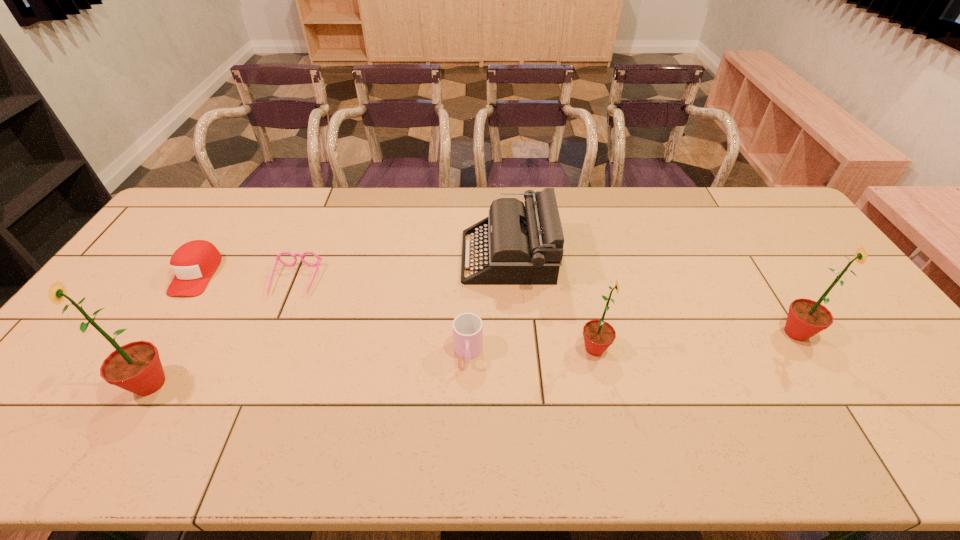
The width and height of the screenshot is (960, 540). Find the location of `vacant space situated 0.200m on the face of the nearest sunflower`. vacant space situated 0.200m on the face of the nearest sunflower is located at coordinates (45, 384).

At what (x,y) coordinates should I click in order to perform the action: click on vacant space located 0.050m on the face of the nearest sunflower. Please return your answer as a coordinate pair (x, y). This screenshot has height=540, width=960. Looking at the image, I should click on (107, 384).

You are a GUI agent. You are given a task and a screenshot of the screen. Output one action in this format:
    pyautogui.click(x=<x>, y=<y>)
    Task: Click on the vacant space located 0.160m on the face of the nearest sunflower
    This screenshot has height=540, width=960.
    Given the screenshot: What is the action you would take?
    pyautogui.click(x=61, y=384)

Locate an element on the screen. free location located on the face of the sixth object from left to right is located at coordinates (649, 349).

Where is `free space located on the face of the second tallest sunflower`? This screenshot has width=960, height=540. free space located on the face of the second tallest sunflower is located at coordinates (877, 333).

This screenshot has width=960, height=540. In order to click on vacant region located on the arms of the third object from left to right in this screenshot , I will do click(x=243, y=408).

Identify the location of free region located on the front-facing side of the baseball cap. (126, 383).

Where is `vacant space located on the typing side of the typewriter`? This screenshot has height=540, width=960. vacant space located on the typing side of the typewriter is located at coordinates (412, 257).

Identify the location of free spot located on the typing side of the typewriter. (351, 257).

This screenshot has height=540, width=960. Identify the location of free point located 0.270m on the typing side of the typewriter. (376, 257).